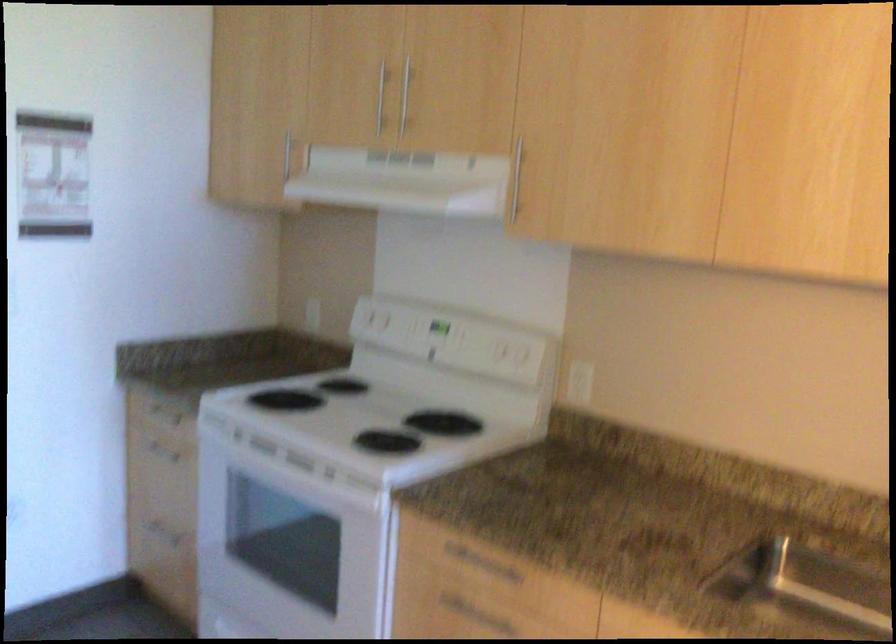
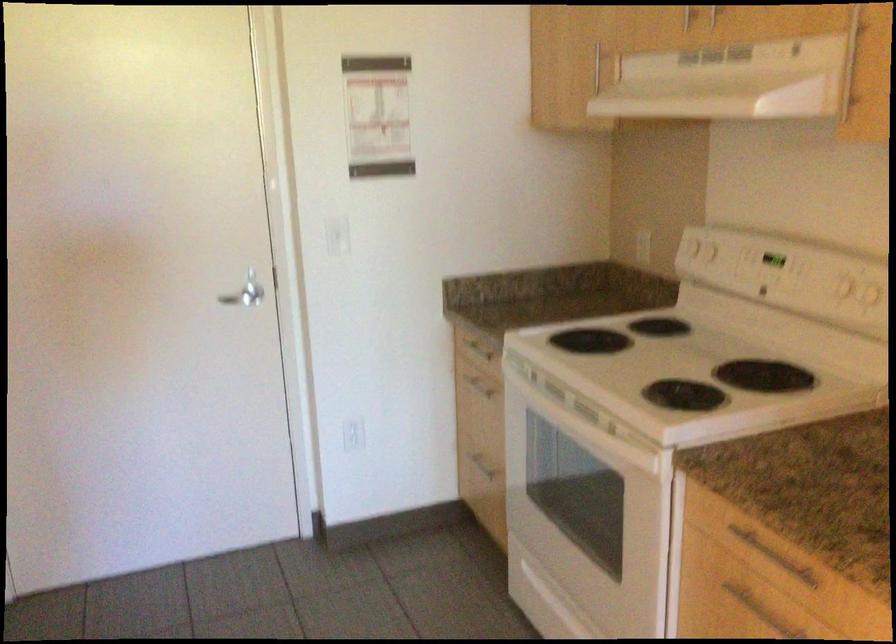
Where in the second image is the point corresponding to pixel 380 417 from the first image?

(686, 365)